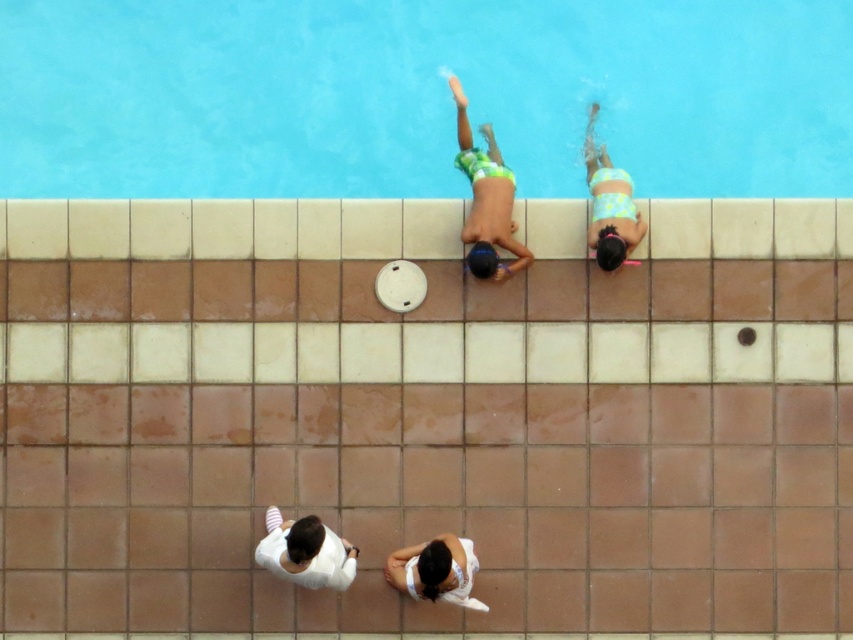
Question: Which point is farther to the camera?

Choices:
 (A) blue glossy water at upper center
 (B) floral swimsuit at upper right

Answer: (A)

Question: Which point is farther from the camera taking this photo?

Choices:
 (A) (445, 556)
 (B) (598, 188)
 (C) (59, 184)

Answer: (C)

Question: Does floral swimsuit at upper right have a larger size compared to white fabric at lower center?

Choices:
 (A) yes
 (B) no

Answer: (A)

Question: Can you confirm if blue glossy water at upper center is positioned above white fabric at lower center?

Choices:
 (A) yes
 (B) no

Answer: (A)

Question: Which of these objects is positioned closest to the white cotton shirt at lower center?

Choices:
 (A) green patterned shorts at center
 (B) blue glossy water at upper center
 (C) white fabric at lower center

Answer: (C)

Question: Can you confirm if white cotton shirt at lower center is positioned below white fabric at lower center?

Choices:
 (A) yes
 (B) no

Answer: (B)